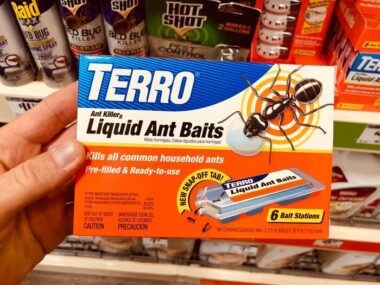
Image resolution: width=380 pixels, height=285 pixels. Find the location of `white label on shelf`. white label on shelf is located at coordinates (369, 132).